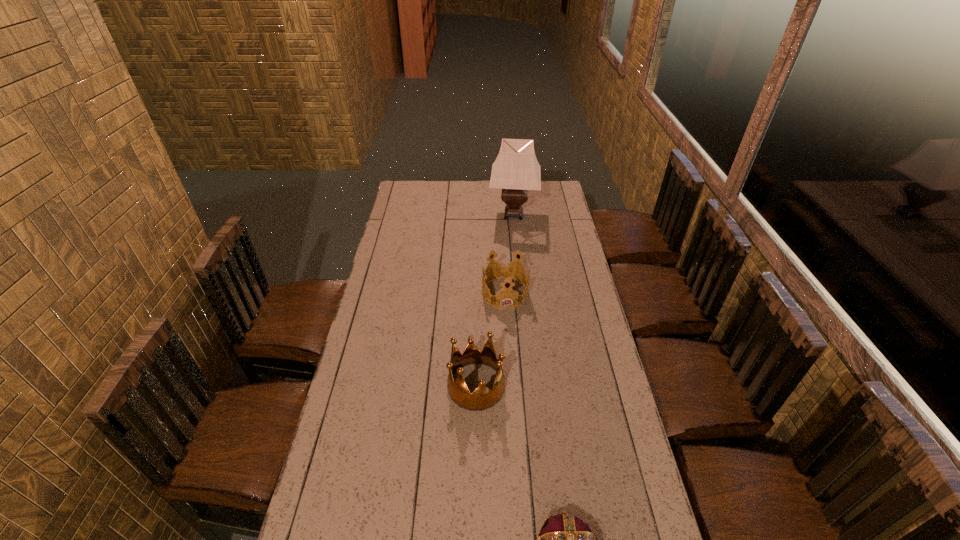
Image resolution: width=960 pixels, height=540 pixels. Find the location of `the farthest object`. the farthest object is located at coordinates (516, 170).

At what (x,y) coordinates should I click in order to perform the action: click on lampshade. Please return your answer as a coordinate pair (x, y). Looking at the image, I should click on (516, 170).

Where is `the second nearest object`? This screenshot has height=540, width=960. the second nearest object is located at coordinates (482, 398).

Where is `the third nearest object`? The image size is (960, 540). the third nearest object is located at coordinates coord(505,271).

Find the location of `vacant space located 0.320m on the left of the farthest object`. vacant space located 0.320m on the left of the farthest object is located at coordinates (426, 214).

This screenshot has height=540, width=960. Identify the location of vacant space located on the back of the second farthest crown. (477, 320).

Where is `free location located 0.100m on the right of the third nearest object`? free location located 0.100m on the right of the third nearest object is located at coordinates (552, 293).

This screenshot has height=540, width=960. What are the coordinates of `object at the far edge` in the screenshot? It's located at (516, 170).

This screenshot has width=960, height=540. Identify the location of object that is at the right edge. (516, 170).

You are a GUI agent. You are given a task and a screenshot of the screen. Output one action in this format:
    pyautogui.click(x=<x>, y=<y>)
    Task: Click on the object located in the far right corner section of the desktop
    This screenshot has width=960, height=540.
    Given the screenshot: What is the action you would take?
    pyautogui.click(x=516, y=170)